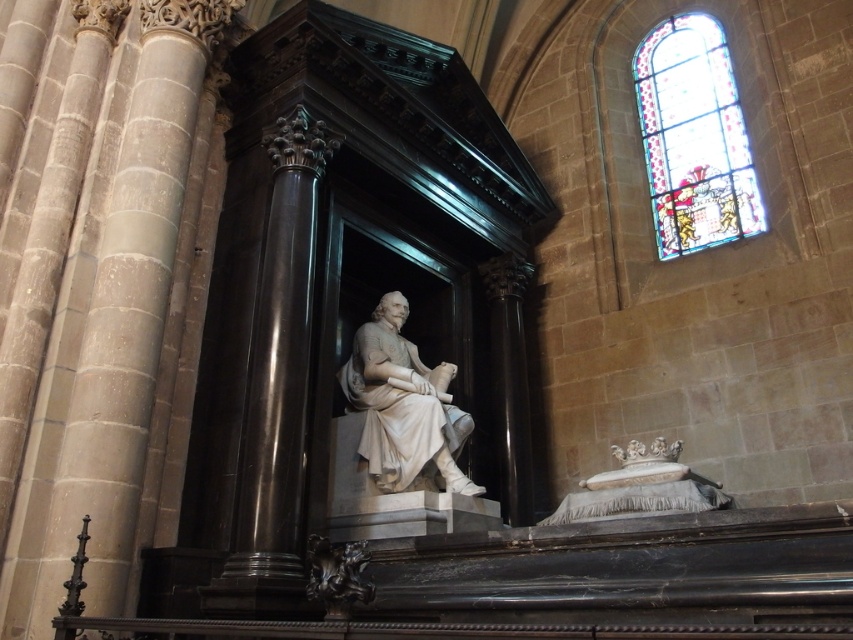
You are a tour guide leading a group through the cathedral and want to point out the stained glass at upper right and the white marble bed at lower right. Which object is closer to the visitors as they enter the cathedral?

The stained glass at upper right is closer to the visitors because it is further to the viewer than the white marble bed at lower right, meaning it is positioned nearer to the entrance where the group is standing.

You are standing in the historic church or cathedral and want to locate the point at coordinates point (693, 138). According to the scene, where would this point be located?

The point (693, 138) is on the stained glass at upper right.